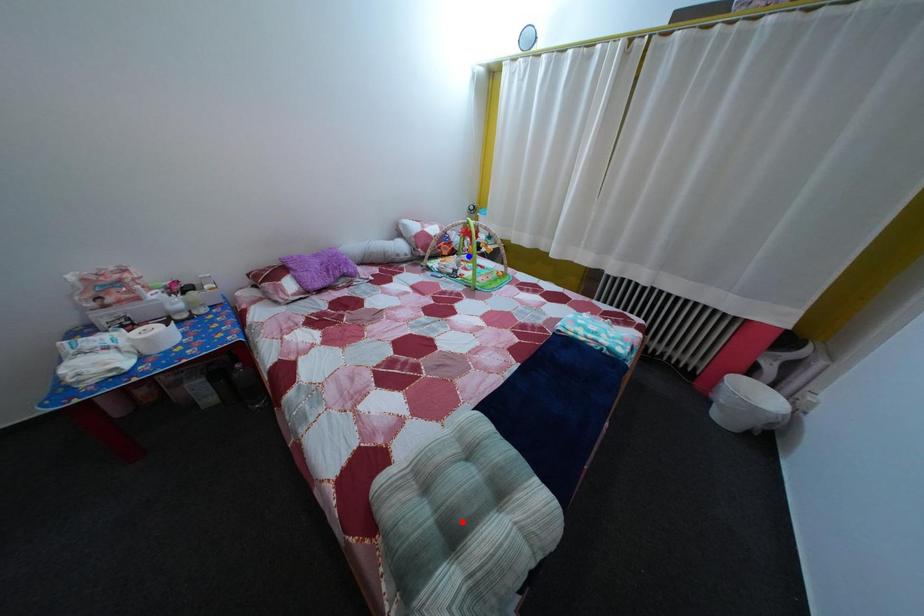
Question: In the image, two points are highlighted. Which point is nearer to the camera? Reply with the corresponding letter.

Choices:
 (A) blue point
 (B) red point

Answer: (B)